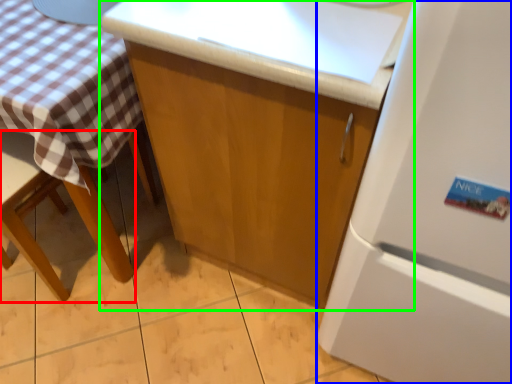
Question: Considering the real-world distances, which object is farthest from chair (highlighted by a red box)? refrigerator (highlighted by a blue box) or cabinetry (highlighted by a green box)?

Choices:
 (A) refrigerator
 (B) cabinetry

Answer: (A)